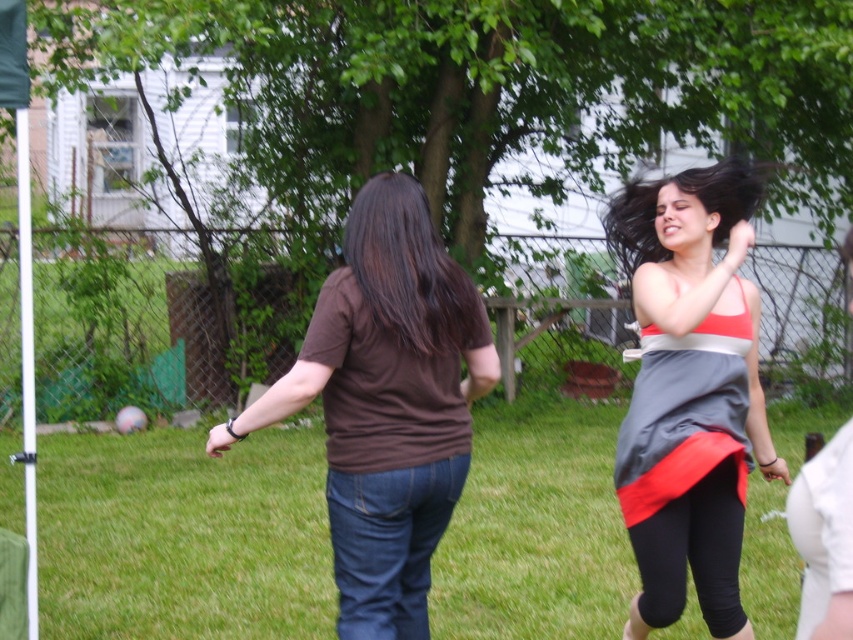
Question: Does green grass at center come in front of gray satin dress at right?

Choices:
 (A) no
 (B) yes

Answer: (A)

Question: From the image, what is the correct spatial relationship of brown cotton t-shirt at center in relation to gray satin dress at right?

Choices:
 (A) above
 (B) below

Answer: (A)

Question: Considering the real-world distances, which object is farthest from the brown cotton t-shirt at center?

Choices:
 (A) gray satin dress at right
 (B) green grass at center

Answer: (B)

Question: Which point appears farthest from the camera in this image?

Choices:
 (A) (395, 528)
 (B) (677, 580)
 (C) (310, 609)

Answer: (C)

Question: Among these points, which one is farthest from the camera?

Choices:
 (A) (41, 589)
 (B) (352, 369)
 (C) (701, 410)

Answer: (A)

Question: Is green grass at center in front of gray satin dress at right?

Choices:
 (A) yes
 (B) no

Answer: (B)